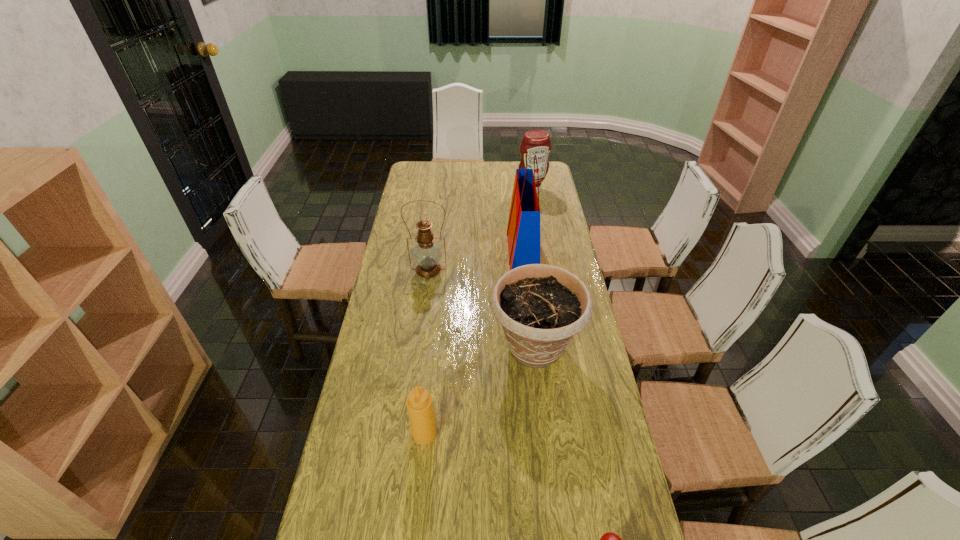
Identify the location of vacant space located 0.060m on the right of the oil lamp. This screenshot has width=960, height=540. (464, 269).

I want to click on free space located on the left of the farthest condiment, so click(x=460, y=190).

In order to click on free space located on the front of the flowerpot in this screenshot , I will do `click(554, 502)`.

Find the location of a particular element. The image size is (960, 540). vacant space situated on the right of the fifth farthest object is located at coordinates (553, 434).

At what (x,y) coordinates should I click in order to perform the action: click on object that is at the left edge. Please return your answer as a coordinate pair (x, y). The height and width of the screenshot is (540, 960). Looking at the image, I should click on (427, 254).

The image size is (960, 540). What are the coordinates of `shopping bag that is at the right edge` in the screenshot? It's located at (523, 231).

At what (x,y) coordinates should I click in order to perform the action: click on condiment that is at the right edge. Please return your answer as a coordinate pair (x, y). Looking at the image, I should click on (535, 142).

Identify the location of flowerpot situated at the right edge. The width and height of the screenshot is (960, 540). click(541, 307).

In the image, there is a desktop. At what (x,y) coordinates should I click in order to perform the action: click on vacant space at the far edge. Please return your answer as a coordinate pair (x, y). Image resolution: width=960 pixels, height=540 pixels. Looking at the image, I should click on (475, 170).

Image resolution: width=960 pixels, height=540 pixels. In the image, there is a desktop. What are the coordinates of `free space at the left edge` in the screenshot? It's located at (359, 504).